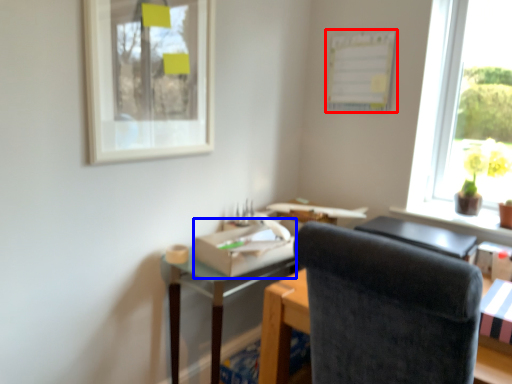
Question: Which object appears closest to the camera in this image, bulletin board (highlighted by a red box) or cardboard box (highlighted by a blue box)?

Choices:
 (A) bulletin board
 (B) cardboard box

Answer: (B)